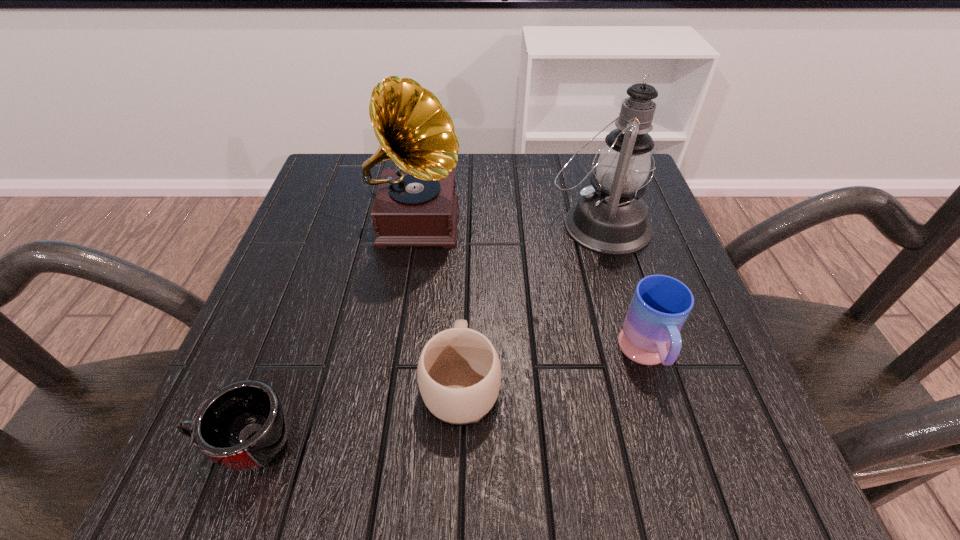
Image resolution: width=960 pixels, height=540 pixels. Identify the location of object that is at the near left corner. (243, 426).

Where is `object present at the far right corner`? This screenshot has width=960, height=540. object present at the far right corner is located at coordinates (610, 218).

In order to click on vacant region at the far edge of the desktop in this screenshot , I will do `click(575, 179)`.

This screenshot has height=540, width=960. I want to click on free location at the near edge of the desktop, so click(x=396, y=489).

You are a GUI agent. You are given a task and a screenshot of the screen. Output one action in this format:
    pyautogui.click(x=<x>, y=<y>)
    Task: Click on the vacant space at the left edge
    
    Given the screenshot: What is the action you would take?
    pyautogui.click(x=294, y=296)

In the image, there is a desktop. At what (x,y) coordinates should I click in order to perform the action: click on vacant space at the right edge. Please return your answer as a coordinate pair (x, y). This screenshot has width=960, height=540. Looking at the image, I should click on (648, 269).

Image resolution: width=960 pixels, height=540 pixels. Find the location of `vacant space at the far left corner of the desktop`. vacant space at the far left corner of the desktop is located at coordinates (338, 190).

You are a GUI agent. You are given a task and a screenshot of the screen. Output one action in this format:
    pyautogui.click(x=<x>, y=<y>)
    Task: Click on the free space that is in between the tallest mug and the phonograph record
    The width and height of the screenshot is (960, 540).
    Given the screenshot: What is the action you would take?
    pyautogui.click(x=532, y=288)

Find the location of a particular element. empty location between the oil lamp and the second mug from left to right is located at coordinates (530, 303).

Locate an element on the screen. The image size is (960, 540). free space between the oil lamp and the leftmost mug is located at coordinates (422, 334).